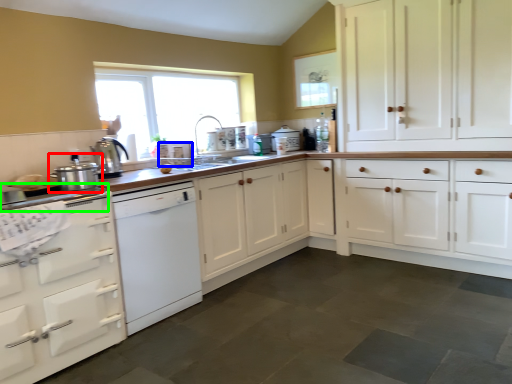
Question: Which is nearer to the kitchen appliance (highlighted by a red box)? appliance (highlighted by a blue box) or appliance (highlighted by a green box).

Choices:
 (A) appliance
 (B) appliance

Answer: (B)